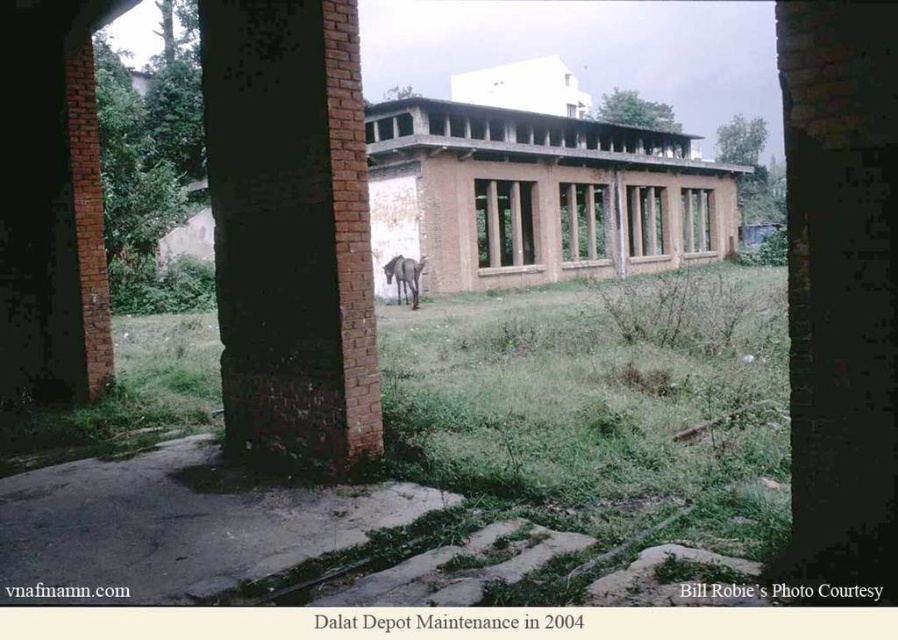
You are standing at the entrance of the dilapidated building and want to reach the green grass at center. According to the coordinates provided, in which direction should you move relative to the building?

The green grass at center is located at point (436,451), which means it is positioned to the right and slightly forward of the building. You should move towards the right and forward from the building to reach it.